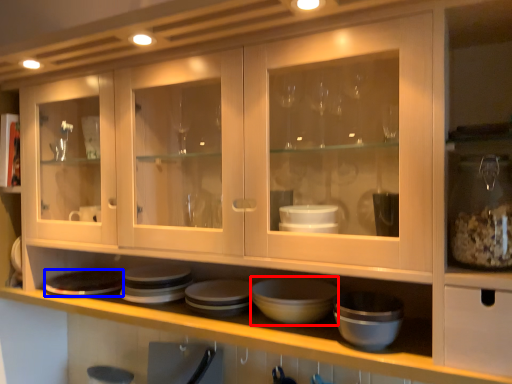
Question: Among these objects, which one is nearest to the camera, basin (highlighted by a red box) or platter (highlighted by a blue box)?

Choices:
 (A) basin
 (B) platter

Answer: (A)